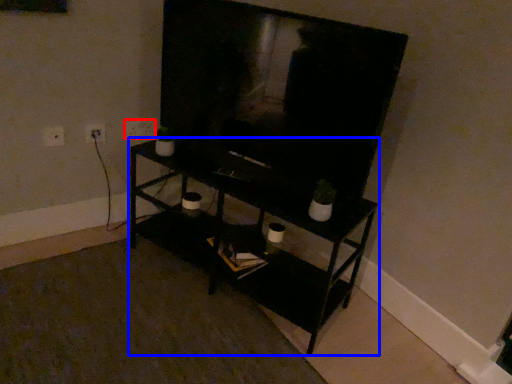
Question: Among these objects, which one is farthest to the camera, electric outlet (highlighted by a red box) or shelf (highlighted by a blue box)?

Choices:
 (A) electric outlet
 (B) shelf

Answer: (A)